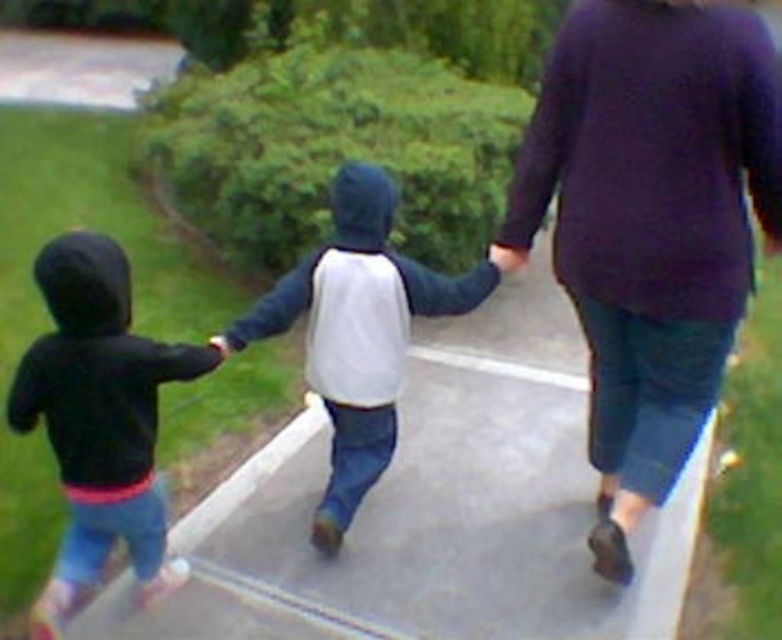
Does point (90, 628) come behind point (608, 161)?

Yes, it is behind point (608, 161).

Does point (458, 442) come in front of point (777, 96)?

No, (458, 442) is further to viewer.

Between point (320, 480) and point (671, 138), which one is positioned behind?

Point (320, 480)

Locate an element on the screen. The height and width of the screenshot is (640, 782). white concrete pavement at center is located at coordinates (433, 508).

The width and height of the screenshot is (782, 640). What are the coordinates of `white concrete pavement at center` in the screenshot? It's located at coord(433,508).

Does white concrete pavement at center lie behind matte black hoodie at left?

Yes, white concrete pavement at center is behind matte black hoodie at left.

Measure the distance between point [546,360] and camera.

4.37 meters

Identify the location of white concrete pavement at center. The width and height of the screenshot is (782, 640). (433, 508).

Which of these two, matte black hoodie at left or white matte hoodie at center, stands taller?

white matte hoodie at center

Measure the distance between matte black hoodie at left and camera.

matte black hoodie at left and camera are 2.27 meters apart.

Where is `matte black hoodie at left`? The height and width of the screenshot is (640, 782). matte black hoodie at left is located at coordinates (99, 420).

Identify the location of matte black hoodie at left. Image resolution: width=782 pixels, height=640 pixels. coord(99,420).